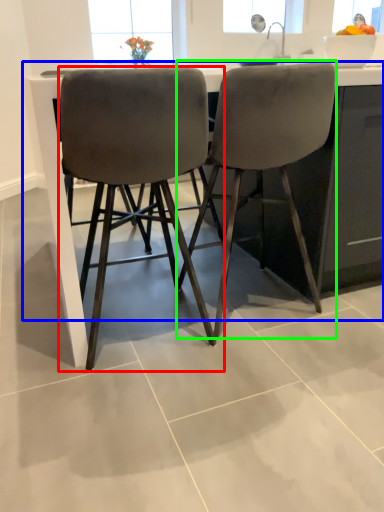
Question: Which is nearer to the chair (highlighted by a red box)? counter (highlighted by a blue box) or chair (highlighted by a green box).

Choices:
 (A) counter
 (B) chair

Answer: (A)